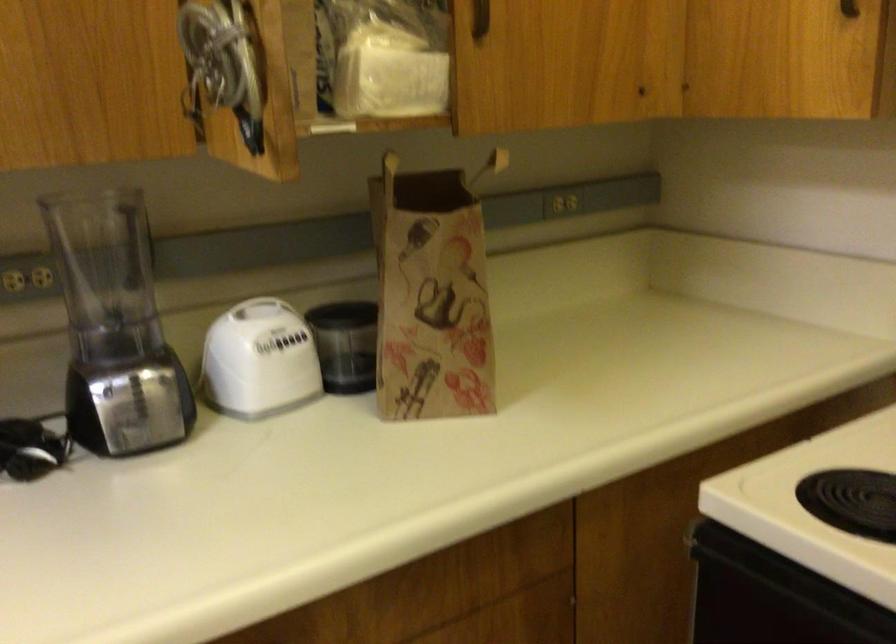
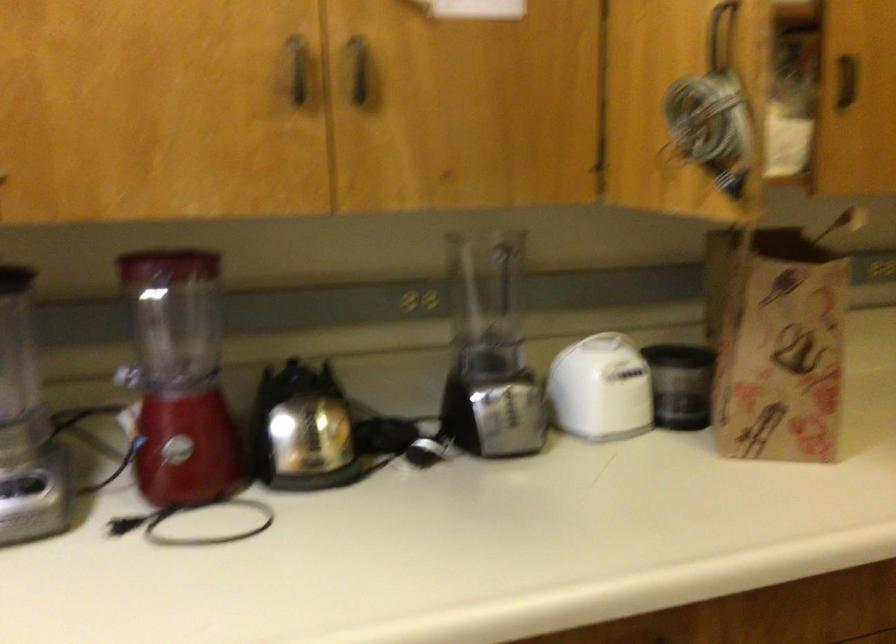
Question: The camera is either moving clockwise (left) or counter-clockwise (right) around the object. The first image is from the beginning of the video and the second image is from the end. Is the camera moving left or right when shooting the video?

Choices:
 (A) Left
 (B) Right

Answer: (B)